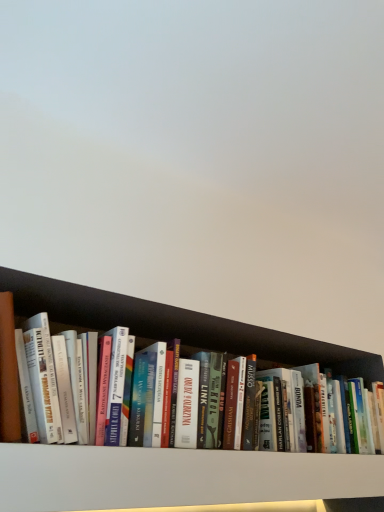
Question: Which direction should I rotate to look at white matte bookshelf at center, the first shelf when ordered from bottom to top?

Choices:
 (A) right
 (B) left

Answer: (A)

Question: From the image's perspective, is black wood shelf at lower center, acting as the 1th shelf starting from the top, under white matte bookshelf at center, the first shelf when ordered from bottom to top?

Choices:
 (A) yes
 (B) no

Answer: (B)

Question: Is black wood shelf at lower center, which ranks as the 2th shelf in bottom-to-top order, looking in the opposite direction of white matte bookshelf at center, the first shelf when ordered from bottom to top?

Choices:
 (A) no
 (B) yes

Answer: (A)

Question: Is black wood shelf at lower center, which ranks as the 2th shelf in bottom-to-top order, at the right side of white matte bookshelf at center, which is the second shelf in top-to-bottom order?

Choices:
 (A) yes
 (B) no

Answer: (A)

Question: Is black wood shelf at lower center, which ranks as the 2th shelf in bottom-to-top order, shorter than white matte bookshelf at center, the first shelf when ordered from bottom to top?

Choices:
 (A) yes
 (B) no

Answer: (B)

Question: Is black wood shelf at lower center, which ranks as the 2th shelf in bottom-to-top order, further to the viewer compared to white matte bookshelf at center, which is the second shelf in top-to-bottom order?

Choices:
 (A) yes
 (B) no

Answer: (A)

Question: Is black wood shelf at lower center, which ranks as the 2th shelf in bottom-to-top order, positioned before white matte bookshelf at center, which is the second shelf in top-to-bottom order?

Choices:
 (A) yes
 (B) no

Answer: (B)

Question: Is white matte bookshelf at center, the first shelf when ordered from bottom to top, to the right of black wood shelf at lower center, acting as the 1th shelf starting from the top, from the viewer's perspective?

Choices:
 (A) yes
 (B) no

Answer: (B)

Question: Can you confirm if white matte bookshelf at center, which is the second shelf in top-to-bottom order, is wider than black wood shelf at lower center, acting as the 1th shelf starting from the top?

Choices:
 (A) yes
 (B) no

Answer: (A)

Question: Does white matte bookshelf at center, which is the second shelf in top-to-bottom order, have a larger size compared to black wood shelf at lower center, which ranks as the 2th shelf in bottom-to-top order?

Choices:
 (A) yes
 (B) no

Answer: (B)

Question: Can you confirm if white matte bookshelf at center, which is the second shelf in top-to-bottom order, is taller than black wood shelf at lower center, acting as the 1th shelf starting from the top?

Choices:
 (A) yes
 (B) no

Answer: (B)

Question: From the image's perspective, is white matte bookshelf at center, the first shelf when ordered from bottom to top, under black wood shelf at lower center, acting as the 1th shelf starting from the top?

Choices:
 (A) yes
 (B) no

Answer: (A)

Question: Is black wood shelf at lower center, acting as the 1th shelf starting from the top, located within white matte bookshelf at center, which is the second shelf in top-to-bottom order?

Choices:
 (A) no
 (B) yes

Answer: (A)

Question: Is black wood shelf at lower center, which ranks as the 2th shelf in bottom-to-top order, wider or thinner than white matte bookshelf at center, the first shelf when ordered from bottom to top?

Choices:
 (A) wide
 (B) thin

Answer: (B)